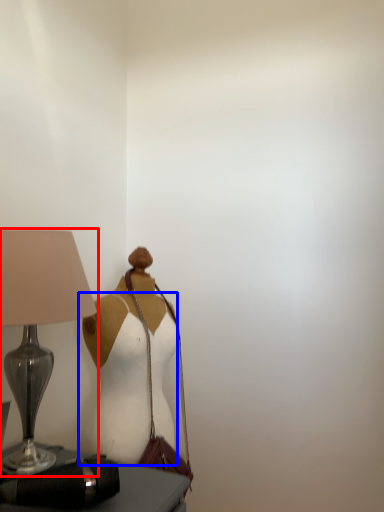
Question: Among these objects, which one is farthest to the camera, lamp (highlighted by a red box) or fancy dress (highlighted by a blue box)?

Choices:
 (A) lamp
 (B) fancy dress

Answer: (B)